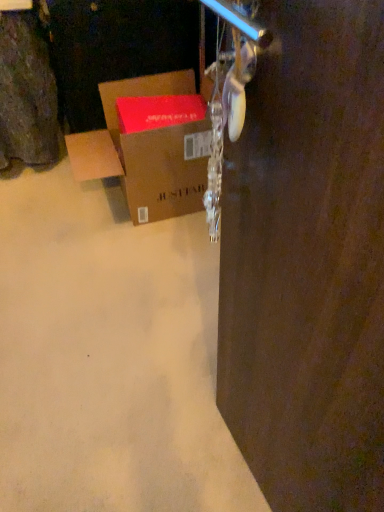
Identify the location of brown cardboard box at center. The width and height of the screenshot is (384, 512). (163, 154).

What do you see at coordinates (163, 154) in the screenshot? I see `brown cardboard box at center` at bounding box center [163, 154].

The width and height of the screenshot is (384, 512). Find the location of `brown cardboard box at center`. brown cardboard box at center is located at coordinates (163, 154).